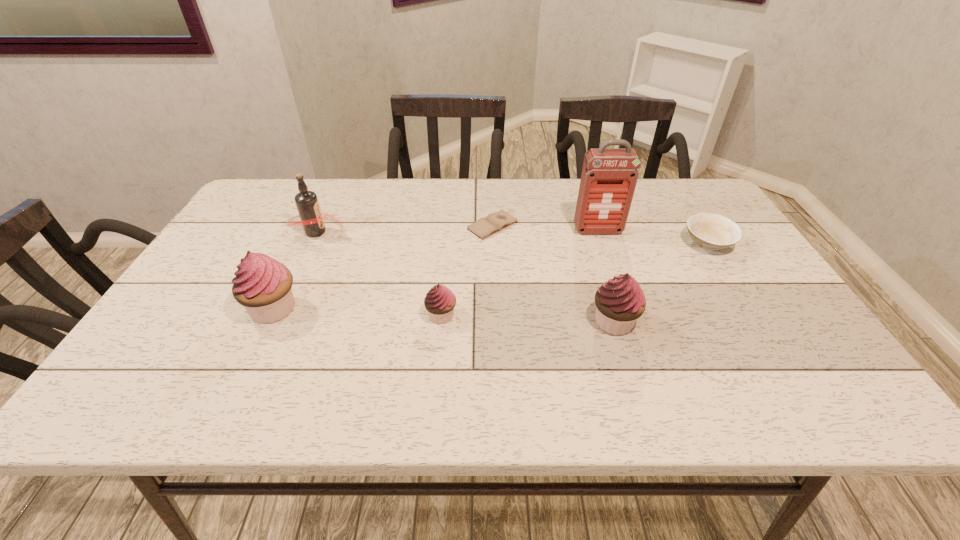
This screenshot has height=540, width=960. What are the coordinates of `cupcake object that ranks as the second closest to the second tallest cupcake` in the screenshot? It's located at (262, 285).

Locate an element on the screen. blank area in the image that satisfies the following two spatial constraints: 1. on the front-facing side of the bowl; 2. on the left side of the tallest object is located at coordinates (602, 244).

This screenshot has width=960, height=540. In order to click on free point that satisfies the following two spatial constraints: 1. on the front side of the fourth tallest object; 2. on the right side of the leftmost cupcake in this screenshot , I will do `click(268, 322)`.

This screenshot has height=540, width=960. Find the location of `vacant region that satisfies the following two spatial constraints: 1. on the front-facing side of the tallest object; 2. on the right side of the bowl`. vacant region that satisfies the following two spatial constraints: 1. on the front-facing side of the tallest object; 2. on the right side of the bowl is located at coordinates (602, 244).